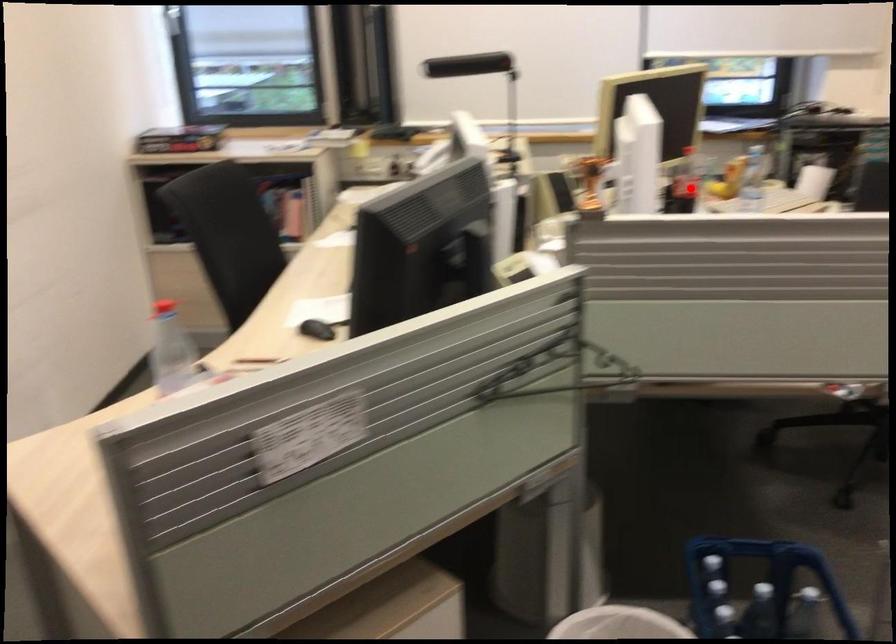
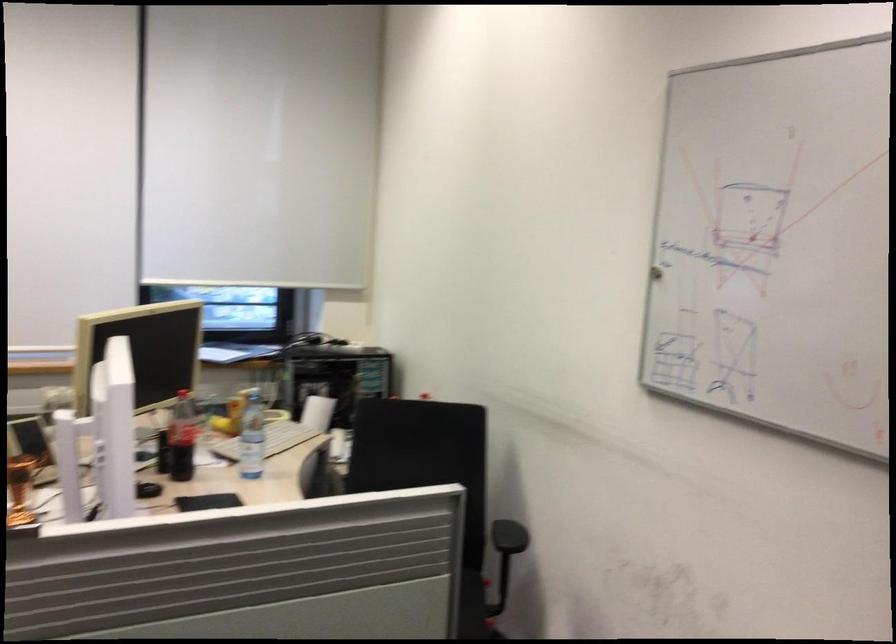
Find the pixel in the second image that matches the highlighted location in the first image.

(182, 438)